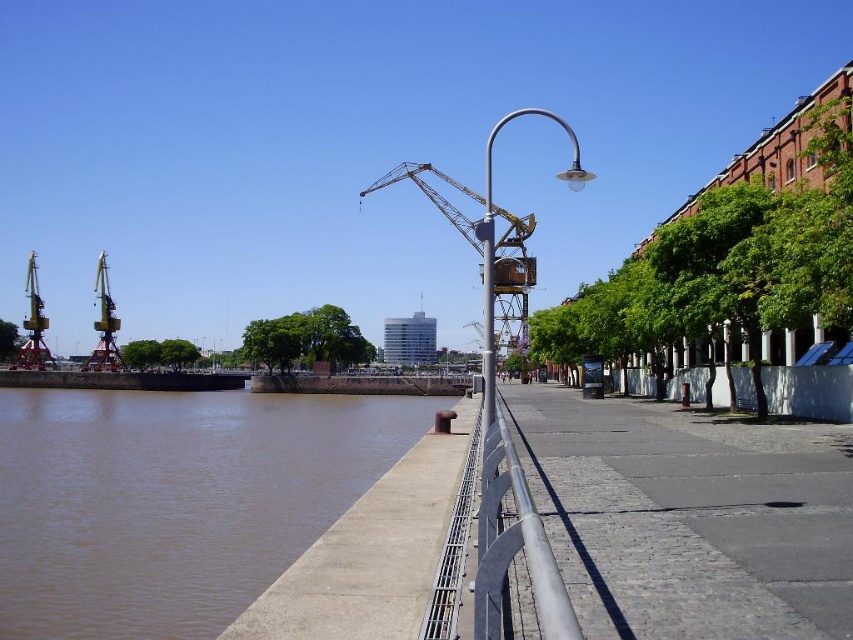
You are standing at the origin point of the image, which is the bottom left corner. You want to walk towards the yellow metallic crane at center. What are the coordinates you need to move to reach it?

The coordinates to reach the yellow metallic crane at center are at point [514,278].

You are standing at the waterfront and want to take a photo of the silver metallic rail at center. If your camera can focus up to 10 meters, will it be able to capture the rail clearly?

The silver metallic rail at center is 12.05 meters away from the camera, which is beyond the camera focus range of 10 meters. Therefore, the camera will not be able to capture the rail clearly.